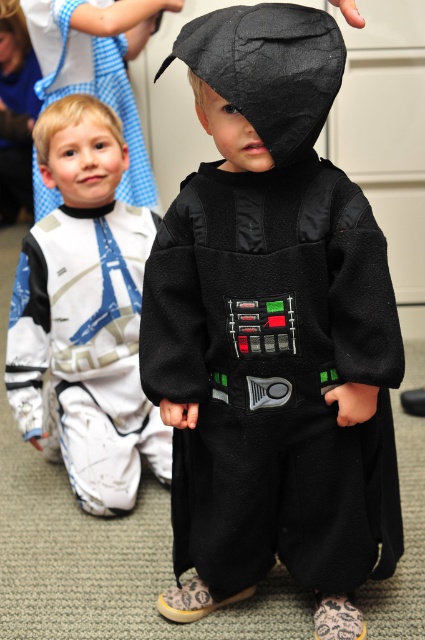
You are standing in front of the image and want to locate the felt black costume at center. Which direction should you look relative to the other child in the costume?

The felt black costume at center is located at point (272,332), so you should look towards the center of the image where the Darth Vader costume is positioned.

You are a photographer setting up a photo shoot for the two children in their costumes. You need to ensure that both costumes are clearly visible in the final shot. Given that the matte black costume at center is taller than the white fleece costume at upper left, where should you position the lighting to avoid shadows obscuring either costume?

To ensure both the matte black costume at center and the white fleece costume at upper left are visible without shadows, position the lighting above and slightly behind the taller matte black costume at center. This will cast the shadow of the taller costume away from the shorter white fleece costume at upper left, keeping both clearly illuminated.

You are organizing a costume parade and need to ensure that the felt black costume at center and the white fleece costume at upper left can fit through a narrow doorway. Based on their sizes, which costume should go first to ensure they both can pass through?

The white fleece costume at upper left should go first because it is smaller than the felt black costume at center, making it easier to navigate through the narrow doorway without obstruction.